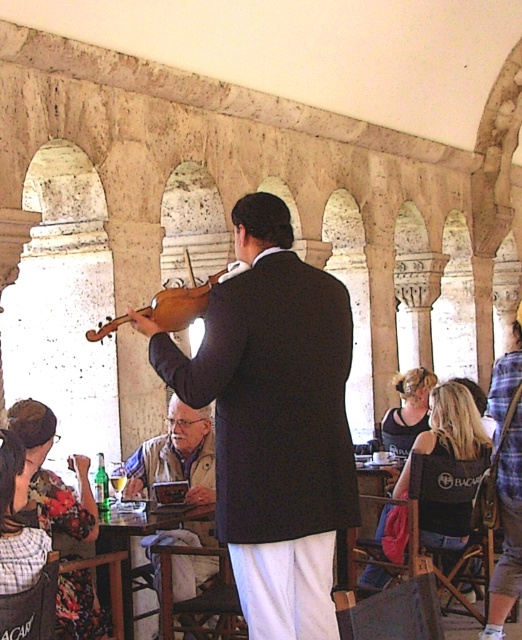
Question: Does dark brown wood violin at center appear on the left side of white textured vest at center?

Choices:
 (A) no
 (B) yes

Answer: (A)

Question: Which point appears closest to the camera in this image?

Choices:
 (A) (165, 301)
 (B) (187, 440)

Answer: (A)

Question: Which of the following is the farthest from the observer?

Choices:
 (A) white textured vest at center
 (B) dark brown wood violin at center

Answer: (A)

Question: Which point is farther to the camera?

Choices:
 (A) (189, 413)
 (B) (172, 330)
 (C) (210, 339)

Answer: (A)

Question: Is dark brown wood violin at center thinner than wooden violin at center?

Choices:
 (A) no
 (B) yes

Answer: (B)

Question: Is the position of white textured vest at center more distant than that of wooden violin at center?

Choices:
 (A) no
 (B) yes

Answer: (B)